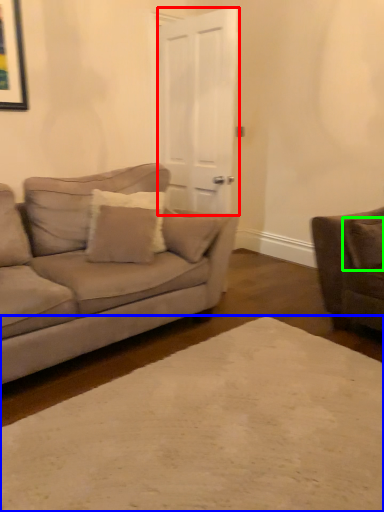
Question: Which object is positioned closest to glass door (highlighted by a red box)? Select from plain (highlighted by a blue box) and pillow (highlighted by a green box).

Choices:
 (A) plain
 (B) pillow

Answer: (B)